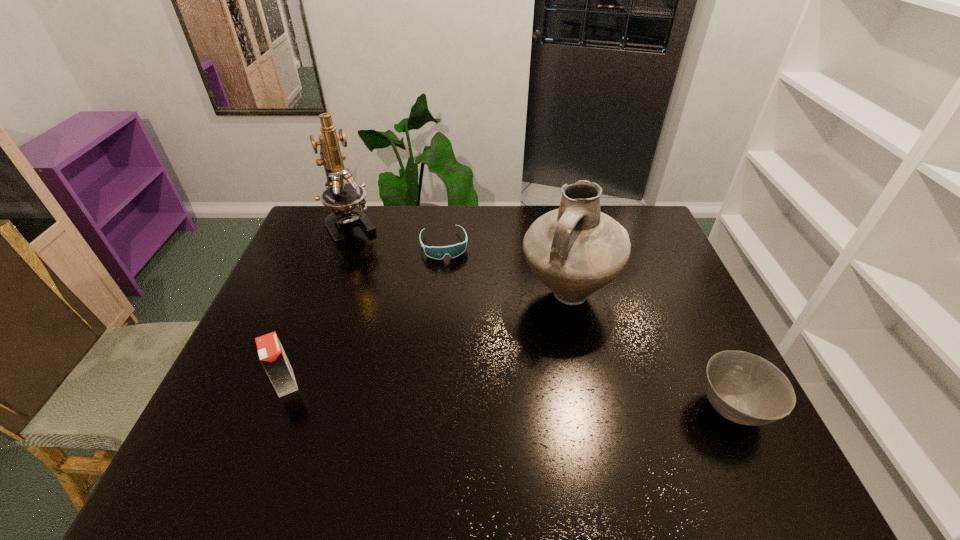
The image size is (960, 540). What are the coordinates of `vacant point located on the handle side of the pitcher` in the screenshot? It's located at (550, 402).

Locate an element on the screen. This screenshot has height=540, width=960. free space located on the handle side of the pitcher is located at coordinates (547, 421).

You are a GUI agent. You are given a task and a screenshot of the screen. Output one action in this format:
    pyautogui.click(x=<x>, y=<y>)
    Task: Click on the free location located 0.100m on the handle side of the pitcher
    Image resolution: width=960 pixels, height=540 pixels.
    Given the screenshot: What is the action you would take?
    pyautogui.click(x=557, y=357)

The width and height of the screenshot is (960, 540). What are the coordinates of `vacant point located 0.200m on the front-facing side of the goggles` in the screenshot? It's located at (457, 303).

Where is `free space located 0.210m on the front-facing side of the goggles`? free space located 0.210m on the front-facing side of the goggles is located at coordinates (457, 306).

You are a GUI agent. You are given a task and a screenshot of the screen. Output one action in this format:
    pyautogui.click(x=<x>, y=<y>)
    Task: Click on the vacant space situated 0.330m on the front-facing side of the goggles
    The image size is (960, 540).
    Given the screenshot: What is the action you would take?
    pyautogui.click(x=465, y=337)

Find the location of a particular element. Image resolution: width=960 pixels, height=540 pixels. free space located 0.230m at the eyepiece of the microscope is located at coordinates (385, 282).

Locate an element on the screen. This screenshot has width=960, height=540. vacant space located 0.330m at the eyepiece of the microscope is located at coordinates (397, 302).

I want to click on vacant space located 0.160m at the eyepiece of the microscope, so click(x=376, y=269).

You are a GUI agent. You are given a task and a screenshot of the screen. Output one action in this format:
    pyautogui.click(x=<x>, y=<y>)
    Task: Click on the goggles that is at the far edge
    The height and width of the screenshot is (540, 960).
    Given the screenshot: What is the action you would take?
    pyautogui.click(x=453, y=251)